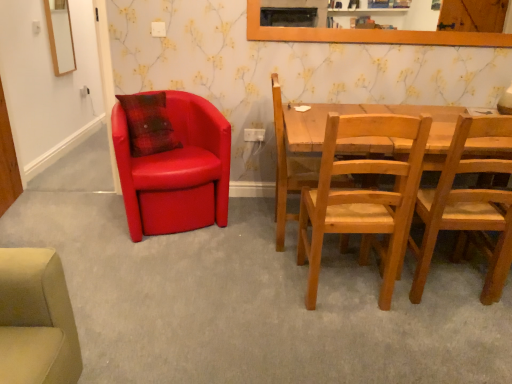
Question: From a real-world perspective, is white plastic power outlet at lower center, placed as the second power outlet when sorted from front to back, positioned over matte leather chair at left, the 4th chair from the right, based on gravity?

Choices:
 (A) no
 (B) yes

Answer: (B)

Question: From the image's perspective, would you say white plastic power outlet at lower center, which is counted as the 2th power outlet, starting from the top, is positioned over matte leather chair at left, which appears as the 1th chair when viewed from the left?

Choices:
 (A) no
 (B) yes

Answer: (B)

Question: From a real-world perspective, is white plastic power outlet at lower center, placed as the second power outlet when sorted from front to back, physically below matte leather chair at left, which appears as the 1th chair when viewed from the left?

Choices:
 (A) yes
 (B) no

Answer: (B)

Question: Can we say white plastic power outlet at lower center, arranged as the first power outlet when ordered from the bottom, lies outside matte leather chair at left, the 4th chair from the right?

Choices:
 (A) yes
 (B) no

Answer: (A)

Question: Does white plastic power outlet at lower center, which is counted as the 2th power outlet, starting from the top, have a greater width compared to matte leather chair at left, which appears as the 1th chair when viewed from the left?

Choices:
 (A) no
 (B) yes

Answer: (A)

Question: From a real-world perspective, relative to wooden-framed mirror at upper left, is light brown wooden chair at right, the fourth chair from the left, vertically above or below?

Choices:
 (A) below
 (B) above

Answer: (A)

Question: Considering the positions of light brown wooden chair at right, the fourth chair from the left, and wooden-framed mirror at upper left in the image, is light brown wooden chair at right, the fourth chair from the left, bigger or smaller than wooden-framed mirror at upper left?

Choices:
 (A) small
 (B) big

Answer: (B)

Question: In the image, is light brown wooden chair at right, acting as the first chair starting from the right, positioned in front of or behind wooden-framed mirror at upper left?

Choices:
 (A) behind
 (B) front

Answer: (B)

Question: Is light brown wooden chair at right, the fourth chair from the left, taller or shorter than wooden-framed mirror at upper left?

Choices:
 (A) tall
 (B) short

Answer: (A)

Question: From their relative heights in the image, would you say wooden chair at center, positioned as the 3th chair in right-to-left order, is taller or shorter than white plastic power outlet at upper center, which is the second power outlet in back-to-front order?

Choices:
 (A) short
 (B) tall

Answer: (B)

Question: Is wooden chair at center, arranged as the 2th chair when viewed from the left, bigger or smaller than white plastic power outlet at upper center, which appears as the second power outlet when viewed from the right?

Choices:
 (A) big
 (B) small

Answer: (A)

Question: In the image, is wooden chair at center, positioned as the 3th chair in right-to-left order, on the left side or the right side of white plastic power outlet at upper center, the second power outlet when ordered from bottom to top?

Choices:
 (A) right
 (B) left

Answer: (A)

Question: From the image's perspective, is wooden chair at center, positioned as the 3th chair in right-to-left order, above or below white plastic power outlet at upper center, which is the second power outlet in back-to-front order?

Choices:
 (A) above
 (B) below

Answer: (B)

Question: From the image's perspective, relative to white plastic power outlet at upper center, which appears as the second power outlet when viewed from the right, is wooden-framed mirror at upper left above or below?

Choices:
 (A) below
 (B) above

Answer: (B)

Question: Considering the positions of wooden-framed mirror at upper left and white plastic power outlet at upper center, the 1th power outlet positioned from the left, in the image, is wooden-framed mirror at upper left taller or shorter than white plastic power outlet at upper center, the 1th power outlet positioned from the left,?

Choices:
 (A) tall
 (B) short

Answer: (A)